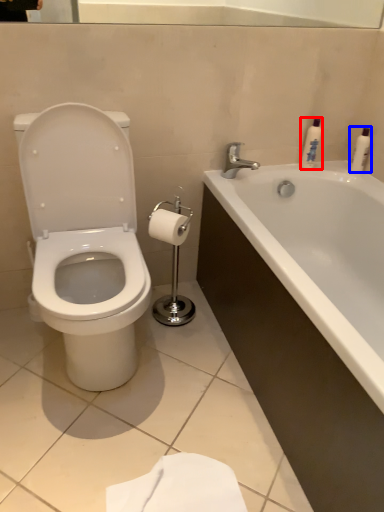
Question: Which point is closer to the camera, toiletry (highlighted by a red box) or toiletry (highlighted by a blue box)?

Choices:
 (A) toiletry
 (B) toiletry

Answer: (A)